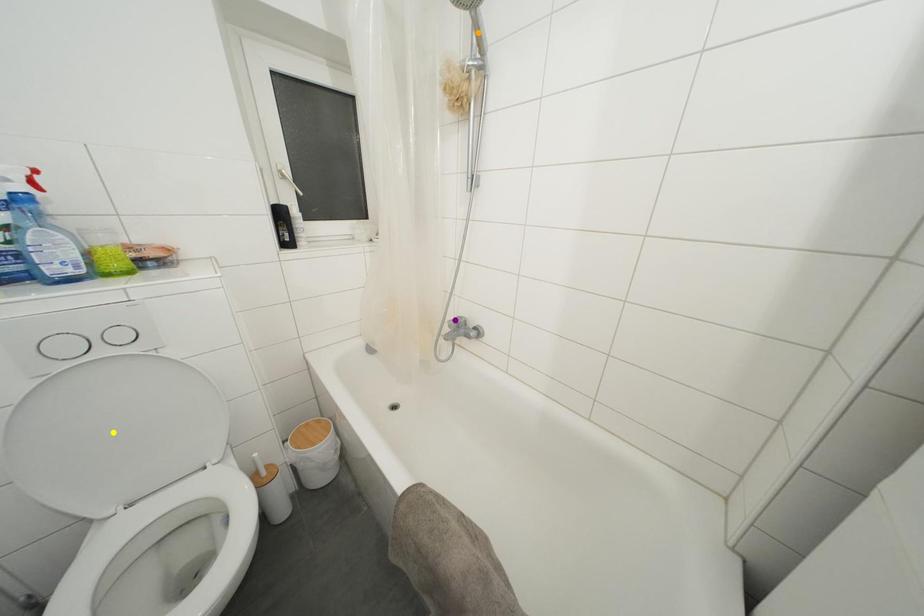
Order these from farthest to nearest:
- yellow point
- purple point
- orange point

1. purple point
2. orange point
3. yellow point